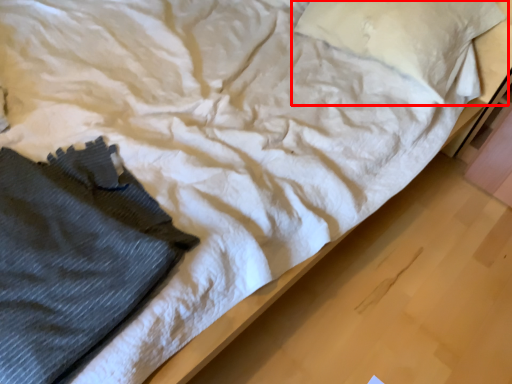
Question: Considering the relative positions of pillow (annotated by the red box) and clothing in the image provided, where is pillow (annotated by the red box) located with respect to the staircase?

Choices:
 (A) right
 (B) left

Answer: (A)